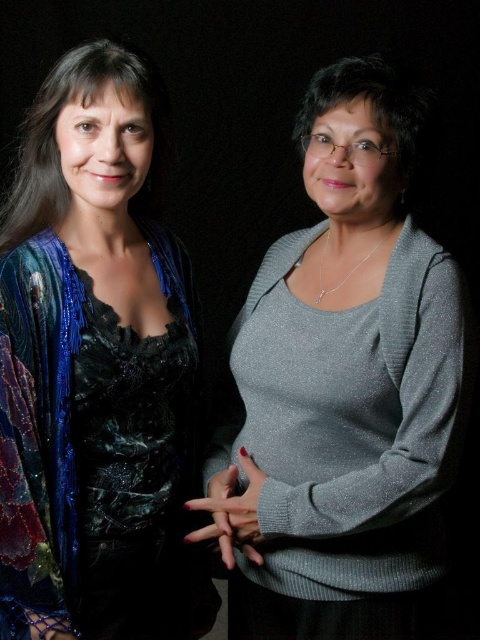
Question: Can you confirm if shiny silver sweater at center is positioned to the left of shiny blue sequined jacket at left?

Choices:
 (A) no
 (B) yes

Answer: (A)

Question: Which point is farther to the camera?

Choices:
 (A) (317, 189)
 (B) (152, 394)

Answer: (B)

Question: Which point is closer to the camera taking this photo?

Choices:
 (A) (122, 240)
 (B) (375, 544)

Answer: (B)

Question: Is shiny silver sweater at center to the right of shiny blue sequined jacket at left from the viewer's perspective?

Choices:
 (A) yes
 (B) no

Answer: (A)

Question: Is shiny silver sweater at center thinner than shiny blue sequined jacket at left?

Choices:
 (A) yes
 (B) no

Answer: (B)

Question: Among these points, which one is farthest from the camera?

Choices:
 (A) (340, 250)
 (B) (93, 280)

Answer: (A)